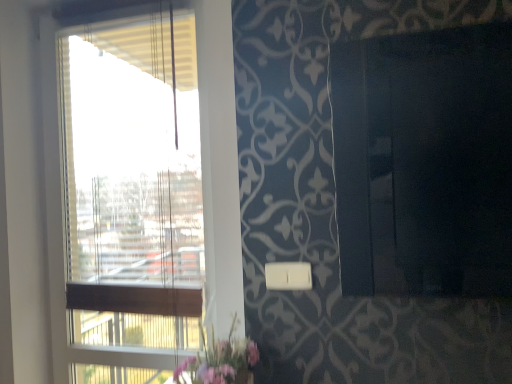
Image resolution: width=512 pixels, height=384 pixels. What are the coordinates of `white plastic light switch at lower center` in the screenshot? It's located at (288, 276).

You are a GUI agent. You are given a task and a screenshot of the screen. Output one action in this format:
    pyautogui.click(x=<x>, y=<y>)
    Task: Click on the transparent glass window at left
    The image size is (512, 384).
    Given the screenshot: What is the action you would take?
    pyautogui.click(x=140, y=186)

Consider the image. Considering the positions of objects transparent glass window at left and pink fabric floral arrangement at lower center in the image provided, who is more to the left, transparent glass window at left or pink fabric floral arrangement at lower center?

transparent glass window at left.

Is transparent glass window at left situated inside pink fabric floral arrangement at lower center or outside?

transparent glass window at left is not inside pink fabric floral arrangement at lower center, it's outside.

This screenshot has height=384, width=512. I want to click on window lying on the left of pink fabric floral arrangement at lower center, so click(140, 186).

Are transparent glass window at left and pink fabric floral arrangement at lower center located far from each other?

Actually, transparent glass window at left and pink fabric floral arrangement at lower center are a little close together.

From a real-world perspective, between transparent glass window at left and white plastic light switch at lower center, who is vertically lower?

white plastic light switch at lower center, from a real-world perspective.

Image resolution: width=512 pixels, height=384 pixels. Identify the location of light switch located underneath the transparent glass window at left (from a real-world perspective). (288, 276).

Can you confirm if transparent glass window at left is shorter than white plastic light switch at lower center?

In fact, transparent glass window at left may be taller than white plastic light switch at lower center.

Is pink fabric floral arrangement at lower center at the back of white plastic light switch at lower center?

white plastic light switch at lower center is not turned away from pink fabric floral arrangement at lower center.

From the image's perspective, is white plastic light switch at lower center located above or below pink fabric floral arrangement at lower center?

white plastic light switch at lower center is above pink fabric floral arrangement at lower center.

Is white plastic light switch at lower center not inside pink fabric floral arrangement at lower center?

Indeed, white plastic light switch at lower center is completely outside pink fabric floral arrangement at lower center.

What's the angular difference between pink fabric floral arrangement at lower center and white plastic light switch at lower center's facing directions?

There is a 2.3-degree angle between the facing directions of pink fabric floral arrangement at lower center and white plastic light switch at lower center.

Can you confirm if pink fabric floral arrangement at lower center is positioned to the left of white plastic light switch at lower center?

Yes.

From a real-world perspective, is pink fabric floral arrangement at lower center physically located above or below white plastic light switch at lower center?

Clearly, from a real-world perspective, pink fabric floral arrangement at lower center is below white plastic light switch at lower center.

In terms of width, does pink fabric floral arrangement at lower center look wider or thinner when compared to white plastic light switch at lower center?

pink fabric floral arrangement at lower center is wider than white plastic light switch at lower center.

Is the surface of pink fabric floral arrangement at lower center in direct contact with transparent glass window at left?

pink fabric floral arrangement at lower center and transparent glass window at left are not in contact.

How far apart are pink fabric floral arrangement at lower center and transparent glass window at left?

The distance of pink fabric floral arrangement at lower center from transparent glass window at left is 21.91 inches.

From the image's perspective, is pink fabric floral arrangement at lower center located above transparent glass window at left?

No.

Which object is positioned more to the right, pink fabric floral arrangement at lower center or transparent glass window at left?

From the viewer's perspective, pink fabric floral arrangement at lower center appears more on the right side.

Is white plastic light switch at lower center at the right side of transparent glass window at left?

Yes.

Can you confirm if white plastic light switch at lower center is thinner than transparent glass window at left?

Yes.

Would you say white plastic light switch at lower center is a long distance from transparent glass window at left?

No, white plastic light switch at lower center is not far away from transparent glass window at left.

Is white plastic light switch at lower center outside of transparent glass window at left?

Absolutely, white plastic light switch at lower center is external to transparent glass window at left.

Identify the location of window lying above the pink fabric floral arrangement at lower center (from the image's perspective). The image size is (512, 384). (140, 186).

Identify the location of light switch that is below the transparent glass window at left (from the image's perspective). The height and width of the screenshot is (384, 512). (288, 276).

Which object lies further to the anchor point transparent glass window at left, pink fabric floral arrangement at lower center or white plastic light switch at lower center?

white plastic light switch at lower center.

Based on the photo, looking at the image, which one is located closer to pink fabric floral arrangement at lower center, white plastic light switch at lower center or transparent glass window at left?

The object closer to pink fabric floral arrangement at lower center is white plastic light switch at lower center.

Considering their positions, is transparent glass window at left positioned closer to white plastic light switch at lower center than pink fabric floral arrangement at lower center?

Among the two, pink fabric floral arrangement at lower center is located nearer to white plastic light switch at lower center.

Looking at the image, which one is located further to white plastic light switch at lower center, pink fabric floral arrangement at lower center or transparent glass window at left?

The object further to white plastic light switch at lower center is transparent glass window at left.

When comparing their distances from pink fabric floral arrangement at lower center, does transparent glass window at left or white plastic light switch at lower center seem further?

Among the two, transparent glass window at left is located further to pink fabric floral arrangement at lower center.

From the image, which object appears to be farther from transparent glass window at left, white plastic light switch at lower center or pink fabric floral arrangement at lower center?

Based on the image, white plastic light switch at lower center appears to be further to transparent glass window at left.

You are a GUI agent. You are given a task and a screenshot of the screen. Output one action in this format:
    pyautogui.click(x=<x>, y=<y>)
    Task: Click on the floral arrangement between transparent glass window at left and white plastic light switch at lower center
    Image resolution: width=512 pixels, height=384 pixels.
    Given the screenshot: What is the action you would take?
    click(220, 361)